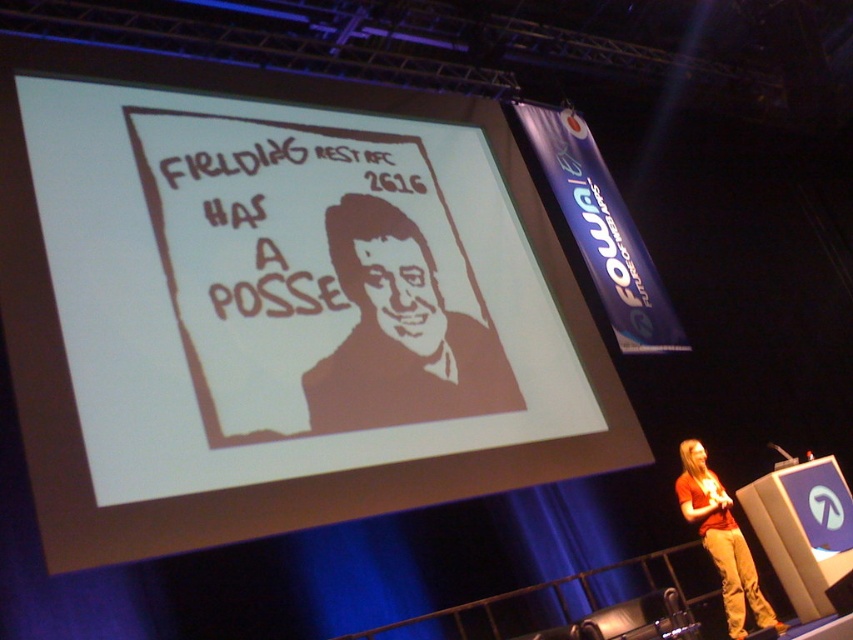
Between point (315, 234) and point (374, 225), which one is positioned behind?

Point (374, 225)

Between white paper at upper center and brown paper portrait at center, which one appears on the right side from the viewer's perspective?

brown paper portrait at center is more to the right.

Which is in front, point (144, 326) or point (363, 280)?

Point (144, 326)

Identify the location of white paper at upper center. (277, 305).

Who is shorter, white paper at upper center or matte orange shirt at lower right?

matte orange shirt at lower right is shorter.

Who is more distant from viewer, [339,147] or [728,552]?

The point [339,147] is behind.

Locate an element on the screen. Image resolution: width=853 pixels, height=640 pixels. white paper at upper center is located at coordinates (277, 305).

Which is in front, point (393, 385) or point (686, 451)?

Positioned in front is point (393, 385).

Does brown paper portrait at center have a greater height compared to matte orange shirt at lower right?

Yes.

Does point (344, 282) come behind point (688, 474)?

No, (344, 282) is closer to viewer.

The height and width of the screenshot is (640, 853). What are the coordinates of `brown paper portrait at center` in the screenshot? It's located at (399, 333).